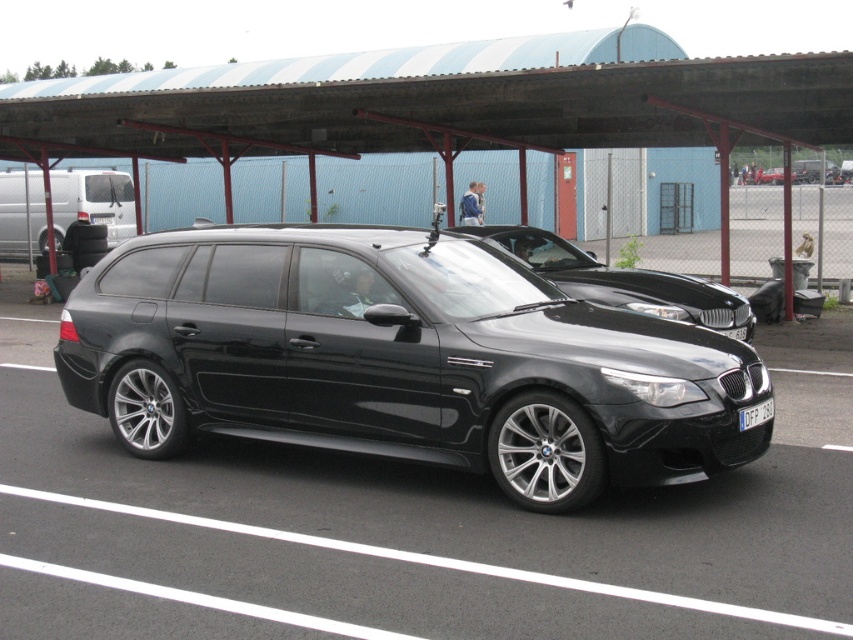
Question: Estimate the real-world distances between objects in this image. Which object is closer to the black metallic car at center?

Choices:
 (A) satin black wagon at center
 (B) blue/white striped roof at upper center
 (C) white plastic license plate at center

Answer: (C)

Question: Which of the following is the closest to the observer?

Choices:
 (A) (404, 433)
 (B) (639, 275)
 (C) (96, 198)
 (D) (770, 412)

Answer: (D)

Question: Is the position of satin black wagon at center less distant than that of black metallic car at center?

Choices:
 (A) yes
 (B) no

Answer: (A)

Question: Which point is closer to the camera taking this photo?

Choices:
 (A) (257, 84)
 (B) (611, 308)
 (C) (112, 204)
 (D) (676, 300)

Answer: (B)

Question: Where is satin black wagon at center located in relation to blue/white striped roof at upper center in the image?

Choices:
 (A) right
 (B) left

Answer: (A)

Question: Can you confirm if satin black wagon at center is thinner than matte silver van at left?

Choices:
 (A) no
 (B) yes

Answer: (B)